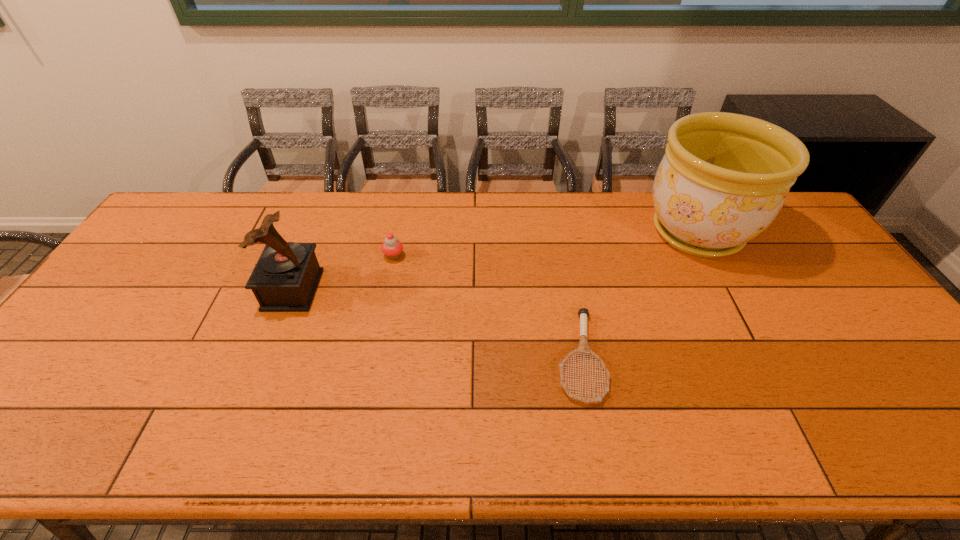
Identify the location of flowerpot. (724, 178).

Identify the location of the rightmost object. (724, 178).

What are the coordinates of `phonograph_record` in the screenshot? It's located at (285, 278).

At what (x,y) coordinates should I click in order to perform the action: click on the second tallest object. Please return your answer as a coordinate pair (x, y). Looking at the image, I should click on (285, 278).

Identify the location of cupcake. The image size is (960, 540). (392, 248).

Where is `the third object from right to left`? The image size is (960, 540). the third object from right to left is located at coordinates (392, 248).

Find the location of a particular element. the nearest object is located at coordinates (583, 348).

The image size is (960, 540). Find the location of `the third object from left to right`. the third object from left to right is located at coordinates (583, 348).

At what (x,y) coordinates should I click in order to perform the action: click on vacant space located on the front of the tallest object. Please return your answer as a coordinate pair (x, y). Looking at the image, I should click on (731, 296).

Where is `free region located 0.370m at the horn opening of the third shortest object`? The image size is (960, 540). free region located 0.370m at the horn opening of the third shortest object is located at coordinates (447, 289).